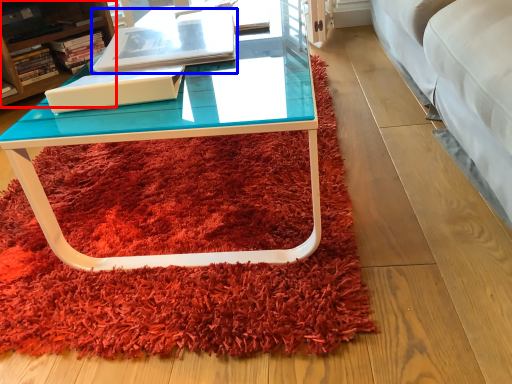
Question: Which object appears closest to the camera in this image, cabinetry (highlighted by a red box) or book (highlighted by a blue box)?

Choices:
 (A) cabinetry
 (B) book

Answer: (B)